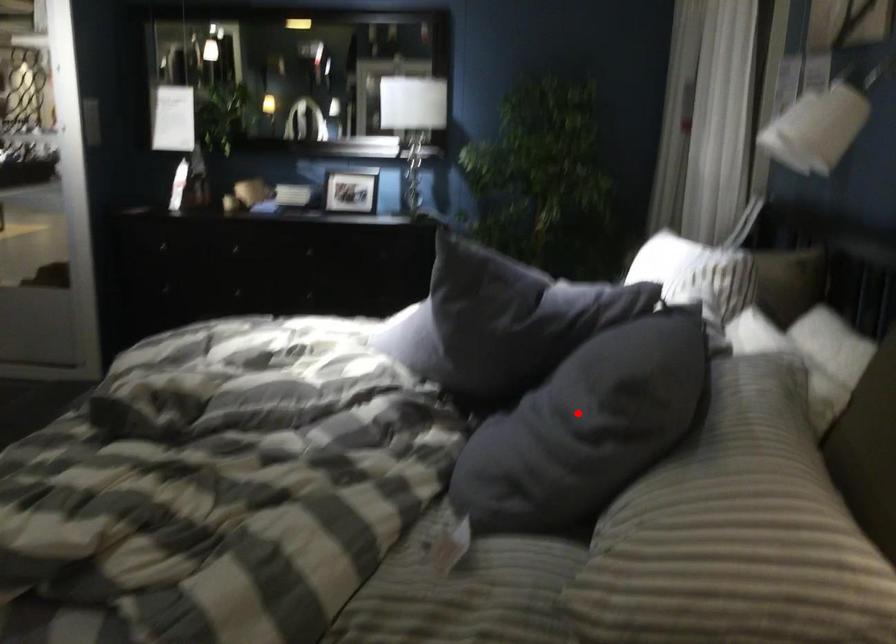
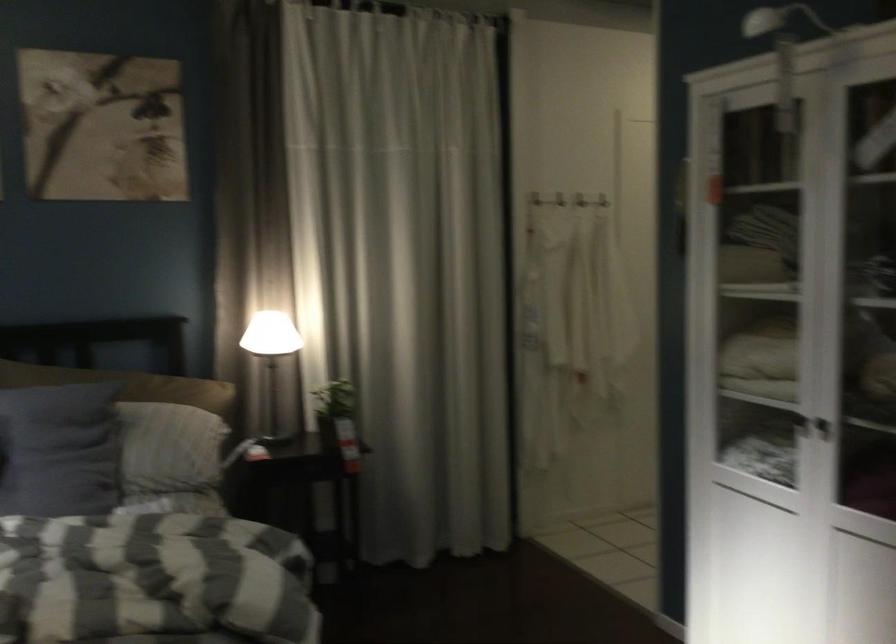
The point at the highlighted location is marked in the first image. Where is the corresponding point in the second image?

(58, 450)